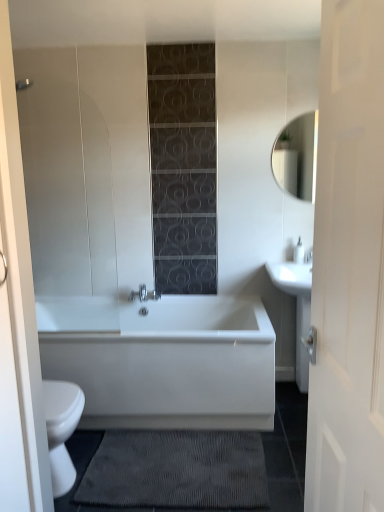
Question: Visually, is matte white mirror at upper right positioned to the left or to the right of white glossy bathtub at center?

Choices:
 (A) right
 (B) left

Answer: (A)

Question: From a real-world perspective, is matte white mirror at upper right positioned above or below white glossy bathtub at center?

Choices:
 (A) above
 (B) below

Answer: (A)

Question: Considering the real-world distances, which object is farthest from the matte silver faucet at upper right?

Choices:
 (A) white glossy sink at right
 (B) dark gray textured bath mat at lower center
 (C) matte white mirror at upper right
 (D) white wood door at right
 (E) white glossy bathtub at center

Answer: (D)

Question: Which object is the closest to the matte silver faucet at upper right?

Choices:
 (A) white glossy sink at right
 (B) dark gray textured bath mat at lower center
 (C) white glossy bathtub at center
 (D) white wood door at right
 (E) matte white mirror at upper right

Answer: (A)